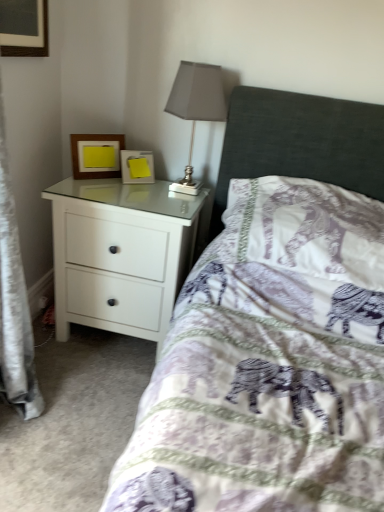
This screenshot has width=384, height=512. Find the location of `empty space that is to the right of wooden picture frame at upper left, the second picture frame in the right-to-left sequence`. empty space that is to the right of wooden picture frame at upper left, the second picture frame in the right-to-left sequence is located at coordinates (145, 185).